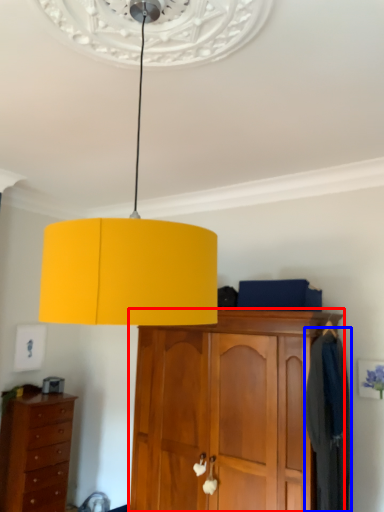
Question: Which point is further to the camera, cabinetry (highlighted by a red box) or clothing (highlighted by a blue box)?

Choices:
 (A) cabinetry
 (B) clothing

Answer: (B)